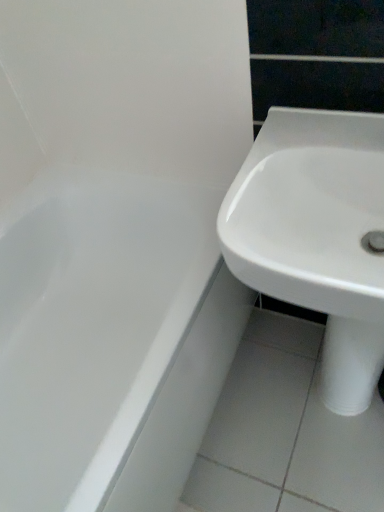
Question: In terms of size, does white glossy bathtub at left appear bigger or smaller than white glossy sink at right?

Choices:
 (A) big
 (B) small

Answer: (A)

Question: Is point (170, 273) positioned closer to the camera than point (349, 312)?

Choices:
 (A) closer
 (B) farther

Answer: (B)

Question: In terms of width, does white glossy bathtub at left look wider or thinner when compared to white glossy sink at right?

Choices:
 (A) wide
 (B) thin

Answer: (A)

Question: Would you say white glossy sink at right is inside or outside white glossy bathtub at left?

Choices:
 (A) inside
 (B) outside

Answer: (B)

Question: Looking at their shapes, would you say white glossy sink at right is wider or thinner than white glossy bathtub at left?

Choices:
 (A) thin
 (B) wide

Answer: (A)

Question: From their relative heights in the image, would you say white glossy sink at right is taller or shorter than white glossy bathtub at left?

Choices:
 (A) tall
 (B) short

Answer: (B)

Question: Is white glossy sink at right in front of or behind white glossy bathtub at left in the image?

Choices:
 (A) front
 (B) behind

Answer: (A)